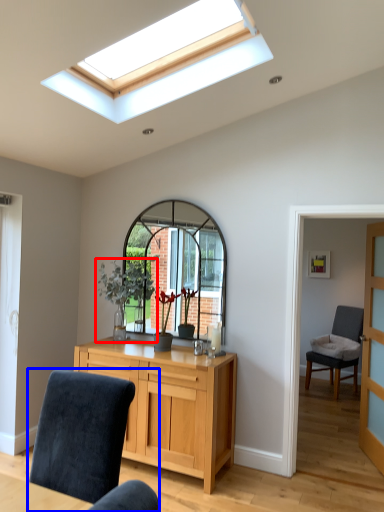
Question: Which object appears farthest to the camera in this image, houseplant (highlighted by a red box) or chair (highlighted by a blue box)?

Choices:
 (A) houseplant
 (B) chair

Answer: (A)